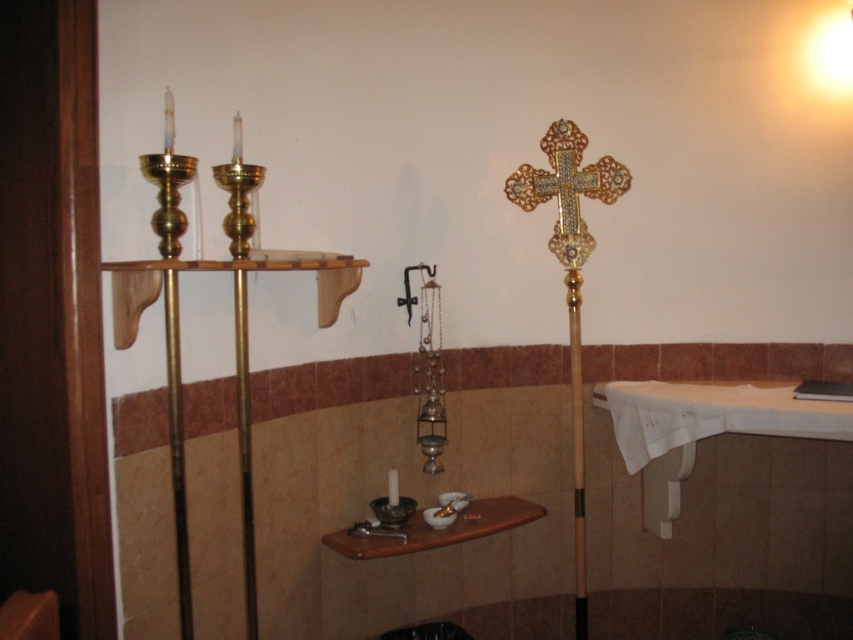
You are standing in the religious space described. There is a point marked at coordinates [570,280]. Which object in the scene does this point correspond to?

The point at coordinates [570,280] corresponds to the gold textured cross at right.

You are an altar attendant who needs to retrieve an item from the matte black candle holder at center. The gold ornate cross at upper right is in your way. Can you move the cross to access the candle holder?

The gold ornate cross at upper right is above the matte black candle holder at center, so it is not blocking the path to the candle holder. You can access the matte black candle holder at center without moving the cross.

What object is located at the coordinates point (x=567, y=188)?

The gold ornate cross at upper right is located at point (x=567, y=188).